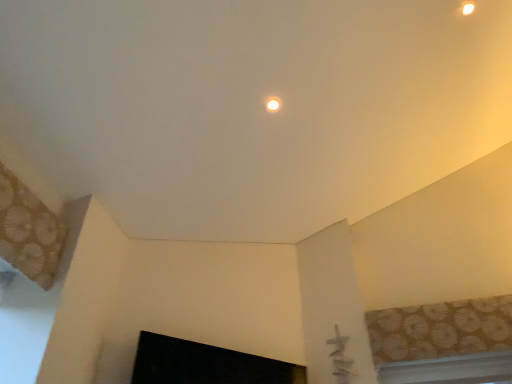
Question: Is patterned fabric window at upper right, placed as the 1th window when sorted from top to bottom, wider than black glossy fireplace at lower center?

Choices:
 (A) yes
 (B) no

Answer: (B)

Question: Is patterned fabric window at upper right, which is counted as the second window, starting from the bottom, bigger than black glossy fireplace at lower center?

Choices:
 (A) yes
 (B) no

Answer: (B)

Question: Can you confirm if patterned fabric window at upper right, which is counted as the second window, starting from the bottom, is taller than black glossy fireplace at lower center?

Choices:
 (A) no
 (B) yes

Answer: (B)

Question: Does patterned fabric window at upper right, which is counted as the second window, starting from the bottom, come in front of black glossy fireplace at lower center?

Choices:
 (A) no
 (B) yes

Answer: (A)

Question: Does patterned fabric window at upper right, placed as the 1th window when sorted from top to bottom, touch black glossy fireplace at lower center?

Choices:
 (A) no
 (B) yes

Answer: (A)

Question: Is patterned fabric window at upper right, which is counted as the second window, starting from the bottom, at the left side of black glossy fireplace at lower center?

Choices:
 (A) no
 (B) yes

Answer: (A)

Question: From a real-world perspective, is black glossy fireplace at lower center positioned over patterned fabric window at upper right, which is counted as the second window, starting from the bottom, based on gravity?

Choices:
 (A) no
 (B) yes

Answer: (A)

Question: From the image's perspective, is black glossy fireplace at lower center beneath patterned fabric window at upper right, placed as the 1th window when sorted from top to bottom?

Choices:
 (A) yes
 (B) no

Answer: (A)

Question: Can you confirm if black glossy fireplace at lower center is thinner than patterned fabric window at upper right, placed as the 1th window when sorted from top to bottom?

Choices:
 (A) yes
 (B) no

Answer: (B)

Question: Can you confirm if black glossy fireplace at lower center is positioned to the right of patterned fabric window at upper right, which is counted as the second window, starting from the bottom?

Choices:
 (A) yes
 (B) no

Answer: (B)

Question: Can you confirm if black glossy fireplace at lower center is shorter than patterned fabric window at upper right, which is counted as the second window, starting from the bottom?

Choices:
 (A) yes
 (B) no

Answer: (A)

Question: Is black glossy fireplace at lower center further to the viewer compared to patterned fabric window at upper right, which is counted as the second window, starting from the bottom?

Choices:
 (A) no
 (B) yes

Answer: (A)

Question: From the image's perspective, is matte white light fixture at upper center on top of black glossy fireplace at lower center?

Choices:
 (A) no
 (B) yes

Answer: (B)